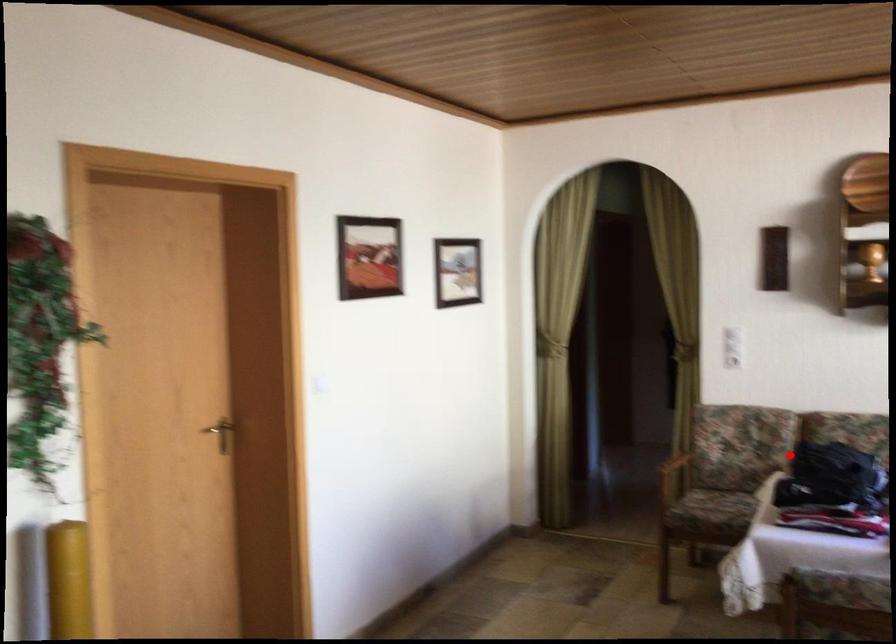
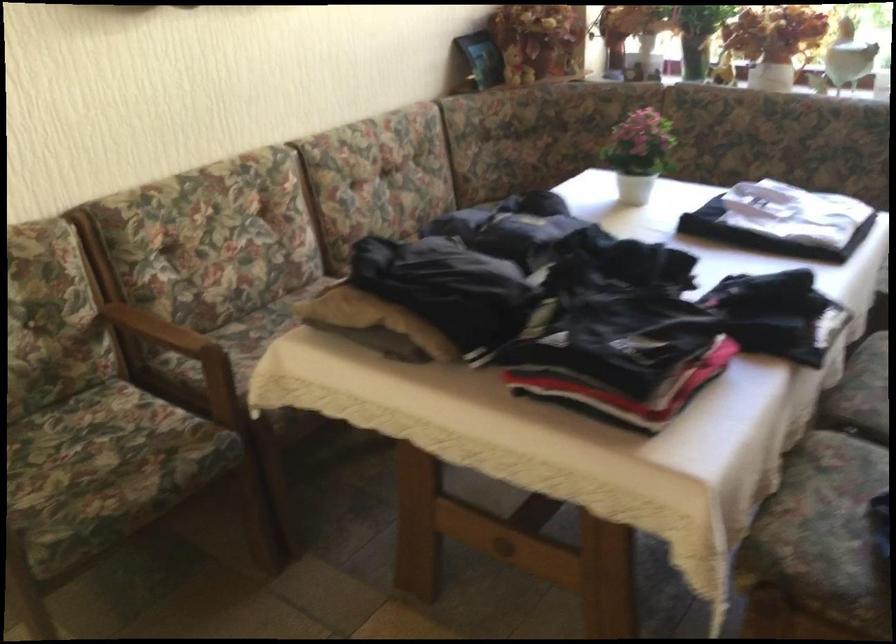
The point at the highlighted location is marked in the first image. Where is the corresponding point in the second image?

(351, 307)